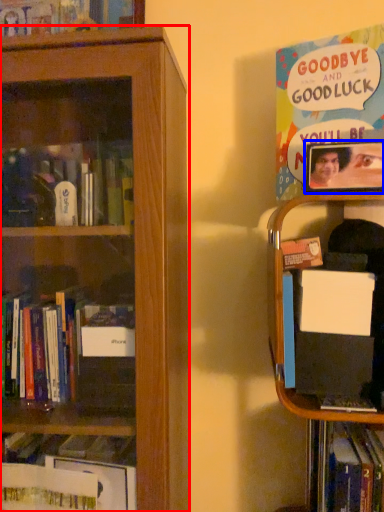
Question: Which object is closer to the camera taking this photo, bookcase (highlighted by a red box) or picture frame (highlighted by a blue box)?

Choices:
 (A) bookcase
 (B) picture frame

Answer: (A)